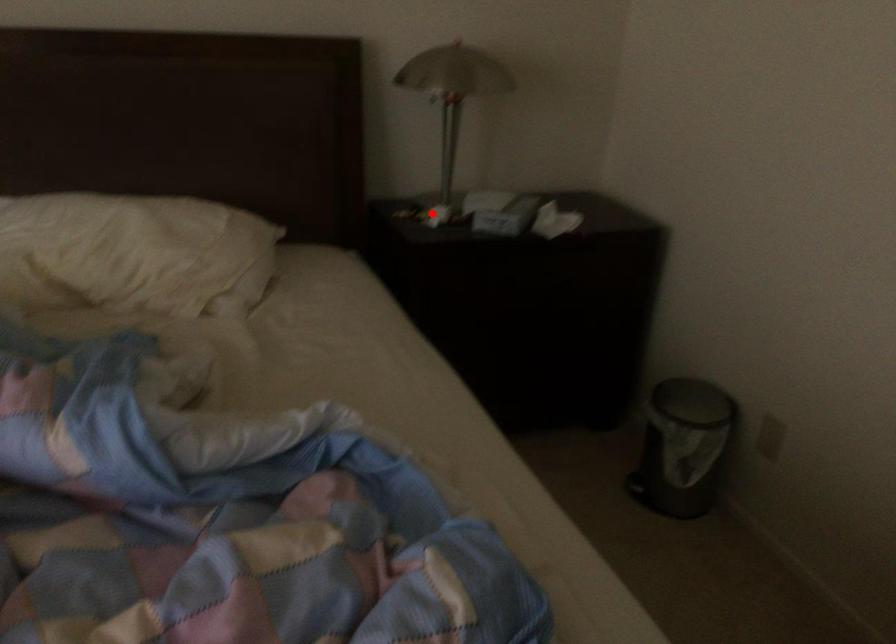
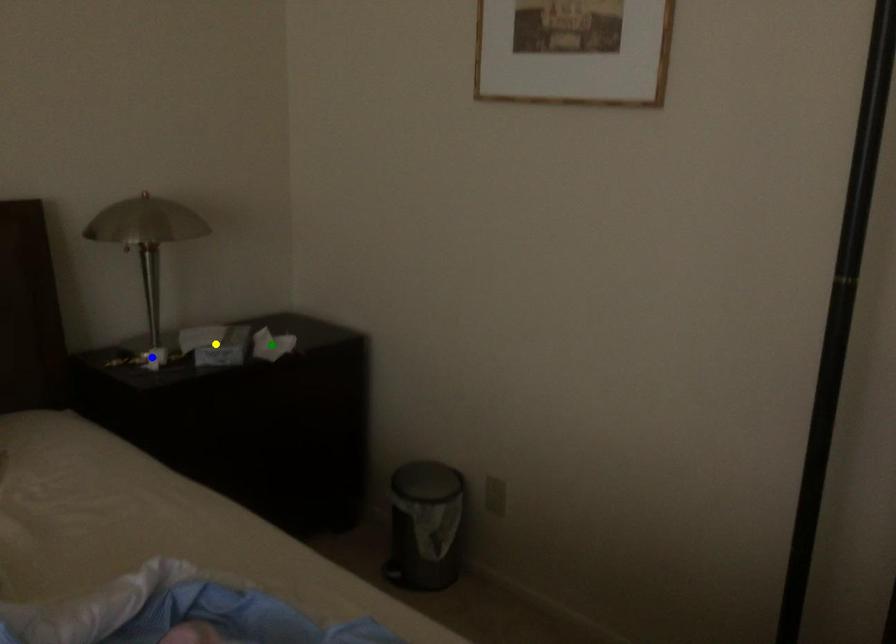
Question: I am providing you with two images of the same scene from different viewpoints. A red point is marked on the first image. You are given multiple points on the second image. In image 2, which mark is for the same physical point as the one in image 1?

Choices:
 (A) green point
 (B) yellow point
 (C) blue point

Answer: (C)